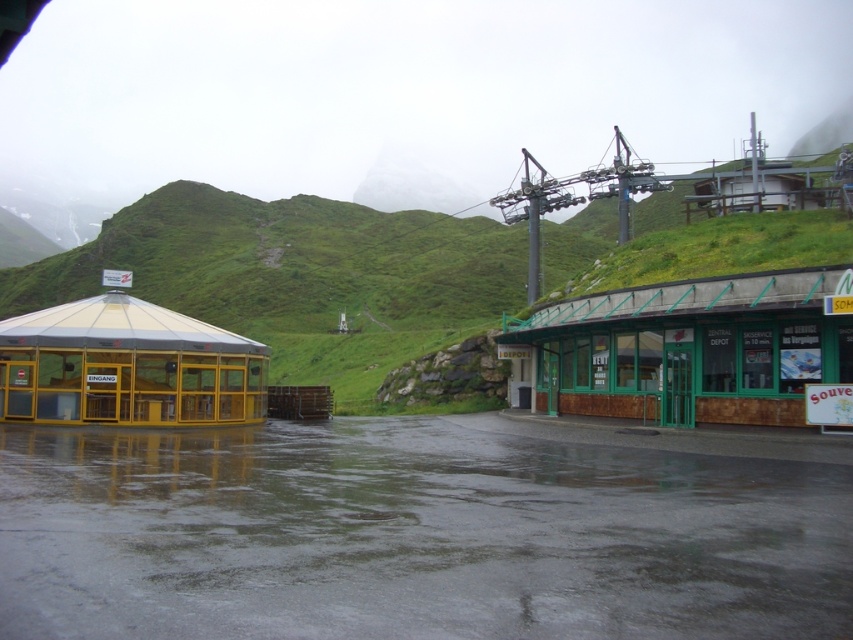
You are planning to install a new solar panel on the roof of either the green wooden hut at center or the transparent glass hut at left. Based on their heights, which building would allow the solar panel to be placed higher from the ground?

The green wooden hut at center has a greater height compared to the transparent glass hut at left, so installing the solar panel on its roof would place it higher from the ground.

You are a tourist trying to find the entrance to the ski resort. You see the green wooden hut at center and the transparent glass hut at left. Which one is closer to you?

The green wooden hut at center is closer to you because it is in front of the transparent glass hut at left.

You are planning to take shelter from the rain. You see a green wooden hut at center and a transparent glass hut at left. Which one provides more space inside?

The green wooden hut at center is larger in size than the transparent glass hut at left, so it provides more space inside.